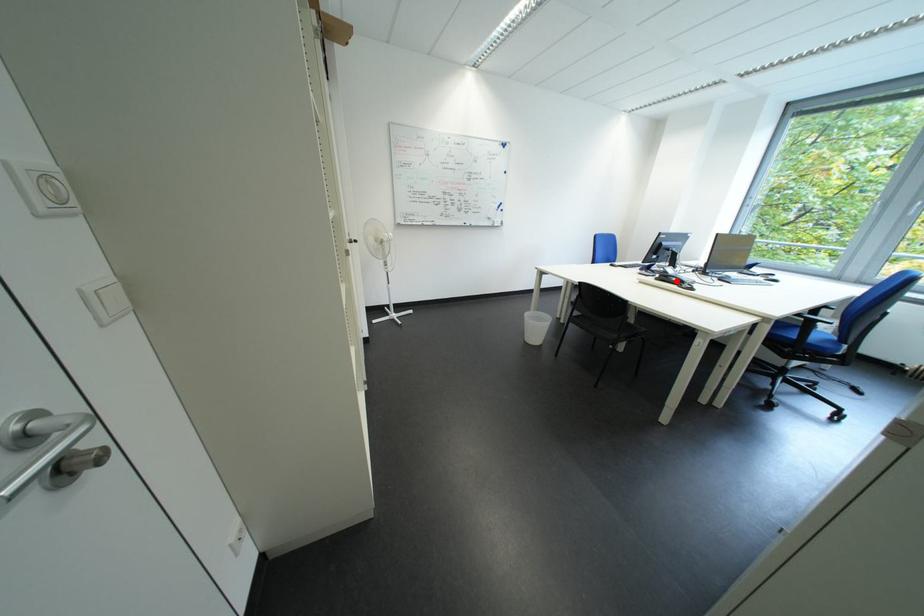
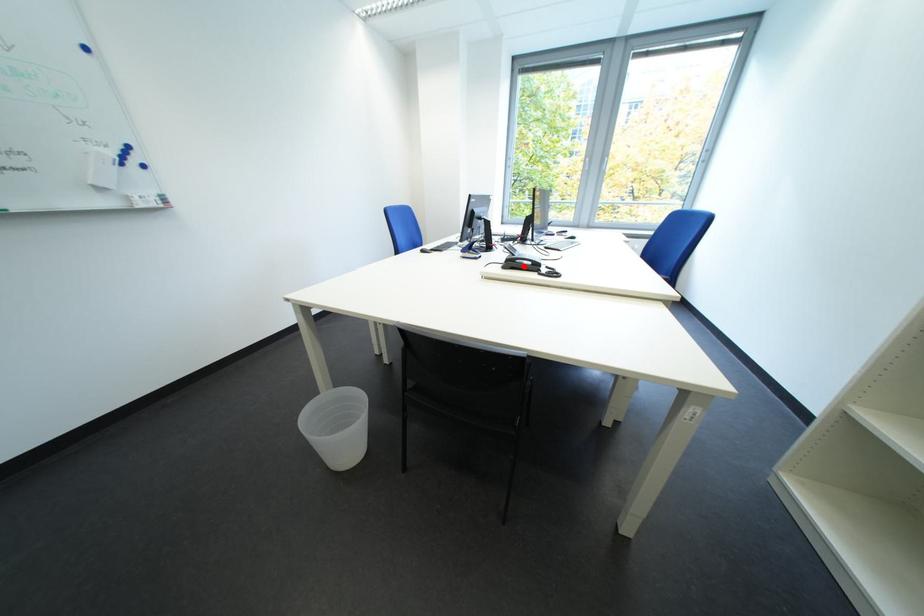
I am providing you with two images of the same scene from different viewpoints. A red point is marked on the first image and another point is marked on the second image. Are the points marked in image1 and image2 representing the same 3D position?

Yes